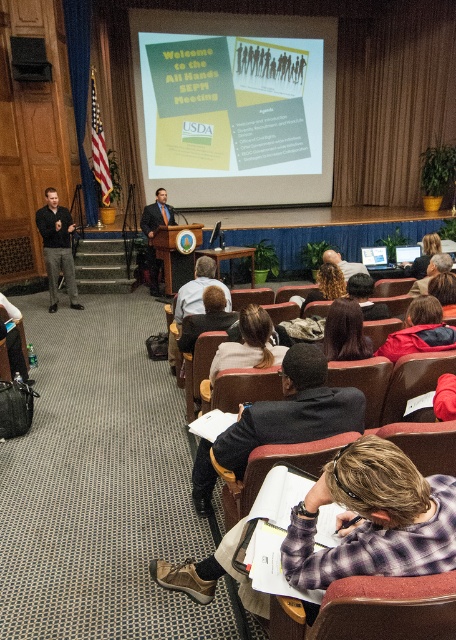
Looking at this image, does red jacket at center have a greater height compared to light brown leather jacket at center?

No, red jacket at center is not taller than light brown leather jacket at center.

Which of these two, red jacket at center or light brown leather jacket at center, stands taller?

light brown leather jacket at center is taller.

Locate an element on the screen. The height and width of the screenshot is (640, 456). red jacket at center is located at coordinates (419, 330).

The image size is (456, 640). Find the location of `red jacket at center`. red jacket at center is located at coordinates (419, 330).

Between black shirt at left and dark brown hair at center, which one appears on the left side from the viewer's perspective?

black shirt at left is more to the left.

Can you confirm if black shirt at left is thinner than dark brown hair at center?

Incorrect, black shirt at left's width is not less than dark brown hair at center's.

The width and height of the screenshot is (456, 640). Describe the element at coordinates (57, 248) in the screenshot. I see `black shirt at left` at that location.

The image size is (456, 640). Identify the location of black shirt at left. (57, 248).

Who is higher up, green matte projection screen at upper center or red jacket at center?

Positioned higher is green matte projection screen at upper center.

Which is in front, point (233, 99) or point (421, 339)?

Point (421, 339) is more forward.

What do you see at coordinates (234, 106) in the screenshot? The image size is (456, 640). I see `green matte projection screen at upper center` at bounding box center [234, 106].

At what (x,y) coordinates should I click in order to perform the action: click on green matte projection screen at upper center. Please return your answer as a coordinate pair (x, y). Looking at the image, I should click on (234, 106).